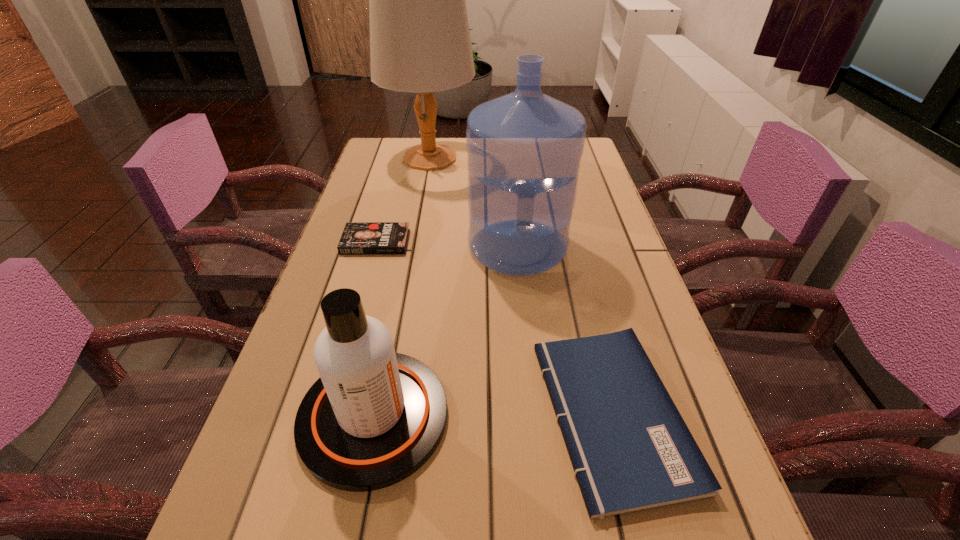
Where is `free location that satisfies the following two spatial constraints: 1. on the back side of the book; 2. on the right side of the farthest object`? This screenshot has width=960, height=540. free location that satisfies the following two spatial constraints: 1. on the back side of the book; 2. on the right side of the farthest object is located at coordinates (400, 158).

Identify the location of free space that satisfies the following two spatial constraints: 1. on the front side of the paperback book; 2. on the right side of the book. (326, 414).

Locate an element on the screen. vacant area that satisfies the following two spatial constraints: 1. on the front side of the paperback book; 2. on the right side of the book is located at coordinates (326, 414).